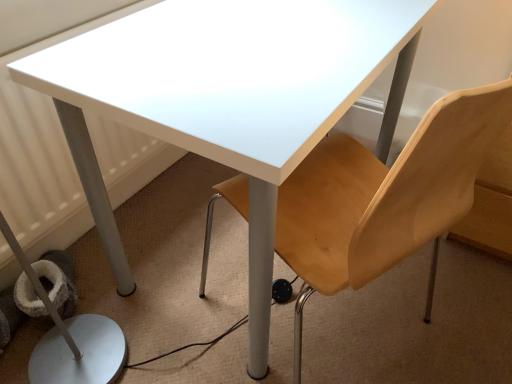
What are the coordinates of `wooden at center` in the screenshot? It's located at (384, 198).

What do you see at coordinates (384, 198) in the screenshot? The image size is (512, 384). I see `wooden at center` at bounding box center [384, 198].

Find the location of `wooden at center`. wooden at center is located at coordinates point(384,198).